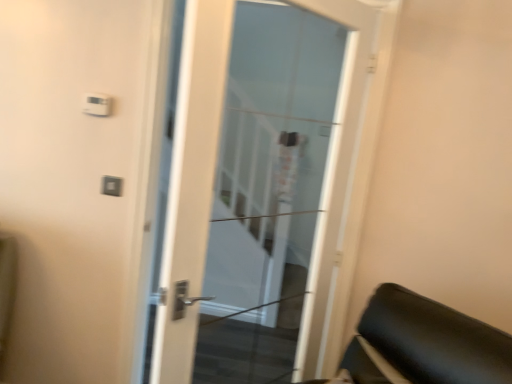
Describe the element at coordinates (111, 186) in the screenshot. I see `matte plastic light switch at upper left` at that location.

Locate an element on the screen. matte plastic light switch at upper left is located at coordinates (111, 186).

What is the approximate width of matte plastic light switch at upper left?

It is 0.58 inches.

This screenshot has width=512, height=384. I want to click on white glass door at center, so click(262, 189).

The height and width of the screenshot is (384, 512). What do you see at coordinates (262, 189) in the screenshot? I see `white glass door at center` at bounding box center [262, 189].

This screenshot has height=384, width=512. In order to click on matte plastic light switch at upper left in this screenshot , I will do `click(111, 186)`.

In the scene shown: Considering the relative positions of matte plastic light switch at upper left and white glass door at center in the image provided, is matte plastic light switch at upper left to the left of white glass door at center from the viewer's perspective?

Correct, you'll find matte plastic light switch at upper left to the left of white glass door at center.

Considering their positions, is matte plastic light switch at upper left located in front of or behind white glass door at center?

Clearly, matte plastic light switch at upper left is behind white glass door at center.

Between point (106, 191) and point (369, 151), which one is positioned behind?

The point (106, 191) is behind.

From the image's perspective, does matte plastic light switch at upper left appear lower than white glass door at center?

Incorrect, from the image's perspective, matte plastic light switch at upper left is higher than white glass door at center.

From a real-world perspective, is matte plastic light switch at upper left on white glass door at center?

No, from a real-world perspective, matte plastic light switch at upper left is not above white glass door at center.

In the scene shown: Which of these two, matte plastic light switch at upper left or white glass door at center, is thinner?

Thinner between the two is matte plastic light switch at upper left.

Who is taller, matte plastic light switch at upper left or white glass door at center?

white glass door at center is taller.

Is matte plastic light switch at upper left bigger than white glass door at center?

No, matte plastic light switch at upper left is not bigger than white glass door at center.

Which is correct: matte plastic light switch at upper left is inside white glass door at center, or outside of it?

The correct answer is: outside.

Is matte plastic light switch at upper left not close to white glass door at center?

Indeed, matte plastic light switch at upper left is not near white glass door at center.

Is white glass door at center at the back of matte plastic light switch at upper left?

No, white glass door at center is not at the back of matte plastic light switch at upper left.

What's the angular difference between matte plastic light switch at upper left and white glass door at center's facing directions?

matte plastic light switch at upper left and white glass door at center are facing 50.9 degrees away from each other.

Find the location of a particular element. door below the matte plastic light switch at upper left (from the image's perspective) is located at coordinates (262, 189).

Consider the image. Considering the relative positions of white glass door at center and matte plastic light switch at upper left in the image provided, is white glass door at center to the left or to the right of matte plastic light switch at upper left?

From the image, it's evident that white glass door at center is to the right of matte plastic light switch at upper left.

In the image, is white glass door at center positioned in front of or behind matte plastic light switch at upper left?

white glass door at center is positioned closer to the viewer than matte plastic light switch at upper left.

Considering the positions of points (166, 354) and (104, 193), is point (166, 354) closer to camera compared to point (104, 193)?

Yes, point (166, 354) is closer to viewer.

From the image's perspective, between white glass door at center and matte plastic light switch at upper left, which one is located above?

matte plastic light switch at upper left, from the image's perspective.

From a real-world perspective, which is physically above, white glass door at center or matte plastic light switch at upper left?

white glass door at center is physically above.

Is white glass door at center wider or thinner than matte plastic light switch at upper left?

In the image, white glass door at center appears to be wider than matte plastic light switch at upper left.

Which of these two, white glass door at center or matte plastic light switch at upper left, stands shorter?

matte plastic light switch at upper left is shorter.

Considering the sizes of objects white glass door at center and matte plastic light switch at upper left in the image provided, who is smaller, white glass door at center or matte plastic light switch at upper left?

matte plastic light switch at upper left is smaller.

Is white glass door at center inside or outside of matte plastic light switch at upper left?

white glass door at center lies outside matte plastic light switch at upper left.

Can you see white glass door at center touching matte plastic light switch at upper left?

No, white glass door at center is not beside matte plastic light switch at upper left.

Is white glass door at center positioned with its back to matte plastic light switch at upper left?

Yes, white glass door at center's orientation is away from matte plastic light switch at upper left.

Image resolution: width=512 pixels, height=384 pixels. Find the location of `door that appears in front of the matte plastic light switch at upper left`. door that appears in front of the matte plastic light switch at upper left is located at coordinates (262, 189).

Find the location of `door below the matte plastic light switch at upper left (from the image's perspective)`. door below the matte plastic light switch at upper left (from the image's perspective) is located at coordinates (262, 189).

Identify the location of door on the right of matte plastic light switch at upper left. This screenshot has width=512, height=384. (262, 189).